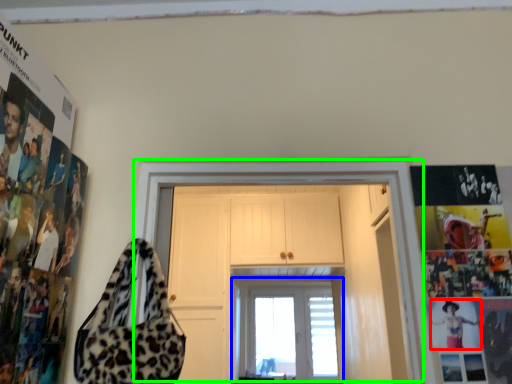
Question: Considering the real-world distances, which object is farthest from person (highlighted by a red box)? window (highlighted by a blue box) or door (highlighted by a green box)?

Choices:
 (A) window
 (B) door

Answer: (A)